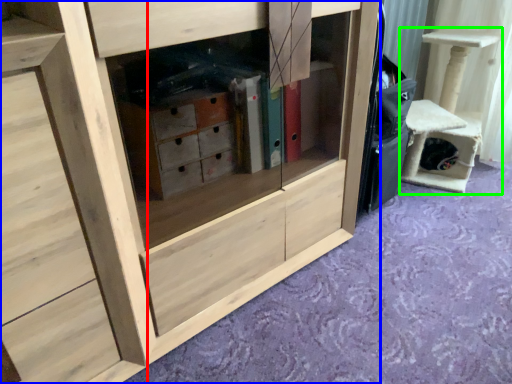
Question: Estimate the real-world distances between objects in this image. Which object is farther from chest of drawers (highlighted by a red box), cabinetry (highlighted by a blue box) or furniture (highlighted by a green box)?

Choices:
 (A) cabinetry
 (B) furniture

Answer: (B)